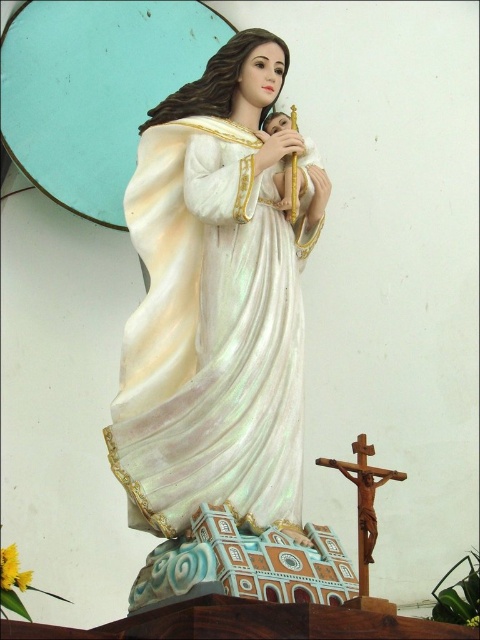
Question: Among these objects, which one is nearest to the camera?

Choices:
 (A) iridescent fabric robe at center
 (B) wooden crucifix at lower right

Answer: (B)

Question: Can you confirm if iridescent fabric robe at center is positioned to the right of wooden crucifix at lower right?

Choices:
 (A) yes
 (B) no

Answer: (B)

Question: Does iridescent fabric robe at center appear under wooden crucifix at lower right?

Choices:
 (A) no
 (B) yes

Answer: (A)

Question: Does iridescent fabric robe at center have a larger size compared to wooden crucifix at lower right?

Choices:
 (A) yes
 (B) no

Answer: (A)

Question: Which of the following is the farthest from the observer?

Choices:
 (A) (252, 282)
 (B) (362, 472)

Answer: (A)